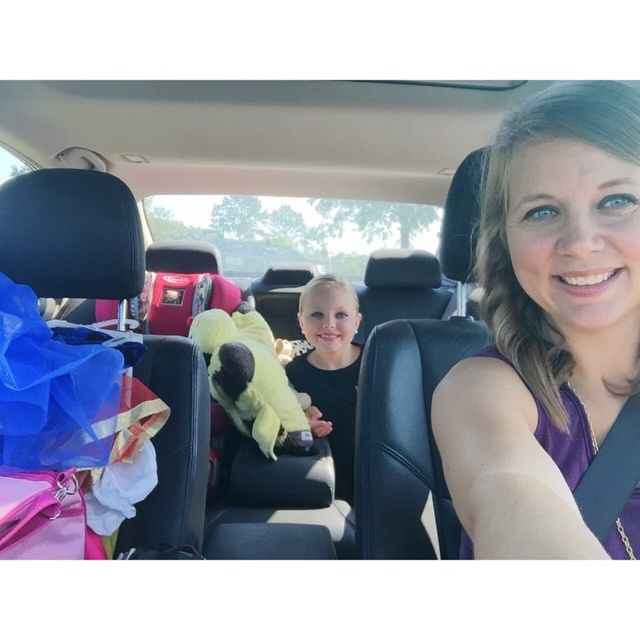
Who is taller, black leather car at center or purple fabric sleeveless top at center?

purple fabric sleeveless top at center

Who is more distant from viewer, (618, 276) or (584, 113)?

The point (618, 276) is behind.

In order to click on black leather car at center in this screenshot , I will do `click(548, 328)`.

Does point (611, 529) come farther from viewer compared to point (209, 358)?

No.

Is black leather car at center bigger than soft yellow plush at center?

No, black leather car at center is not bigger than soft yellow plush at center.

I want to click on black leather car at center, so click(x=548, y=328).

At what (x,y) coordinates should I click in order to perform the action: click on black leather car at center. Please return your answer as a coordinate pair (x, y). The height and width of the screenshot is (640, 640). Looking at the image, I should click on (548, 328).

Is point (534, 529) closer to viewer compared to point (339, 442)?

Yes, it is in front of point (339, 442).

Does point (516, 531) come farther from viewer compared to point (291, 374)?

No, (516, 531) is in front of (291, 374).

Where is `purple fabric sleeveless top at center`? This screenshot has width=640, height=640. purple fabric sleeveless top at center is located at coordinates [x=548, y=328].

The width and height of the screenshot is (640, 640). Find the location of `purple fabric sleeveless top at center`. purple fabric sleeveless top at center is located at coordinates (548, 328).